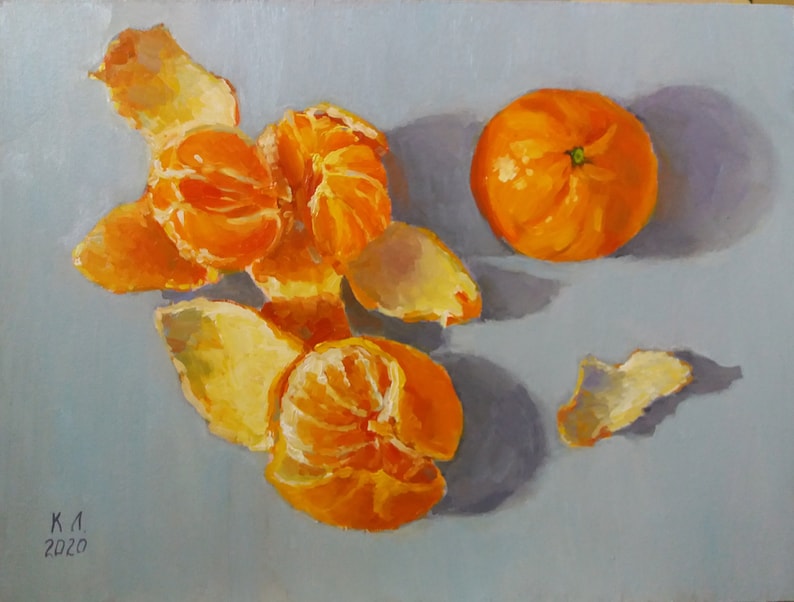
This screenshot has height=602, width=794. Identify the location of grey canvas. (430, 81).